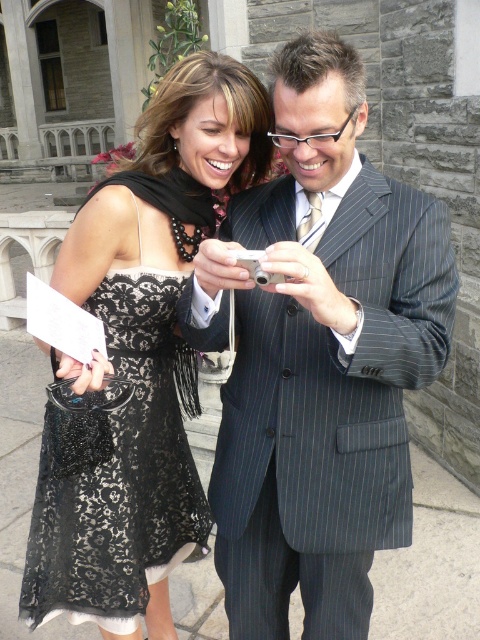
You are a photographer at a fashion show and you need to arrange two models for a photo. The models are wearing the pinstriped suit at center and the black lace dress at center. Based on their positions in the current image, which model should you move to the left to create a balanced composition?

The pinstriped suit at center is to the right of the black lace dress at center. To balance the composition, move the pinstriped suit at center further to the right or move the black lace dress at center further to the left.

You are a photographer trying to decide where to place two subjects in a photo shoot. The subjects are wearing the pinstriped suit at center and the black lace dress at center. You want to arrange them side by side so that the thinner subject is on the left. Which subject should you place on the left?

The pinstriped suit at center is thinner than the black lace dress at center, so you should place the pinstriped suit at center on the left to follow the arrangement requirement.

You are a photographer trying to capture a photo of both the pinstriped suit at center and the black lace dress at center in the same frame. Based on their positions, which one should you focus on first to ensure both are in the frame?

The pinstriped suit at center is located above the black lace dress at center, so you should focus on the pinstriped suit at center first to ensure both are in the frame.